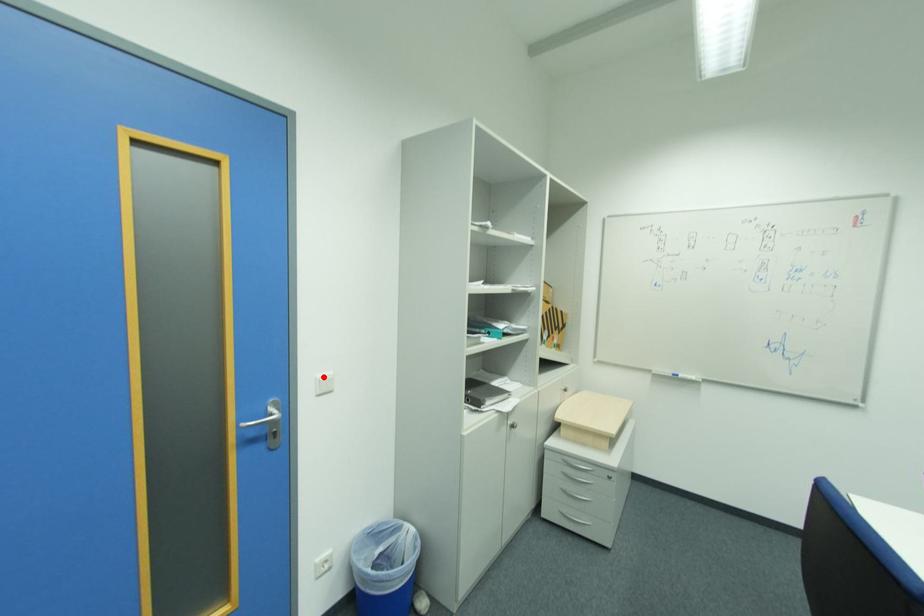
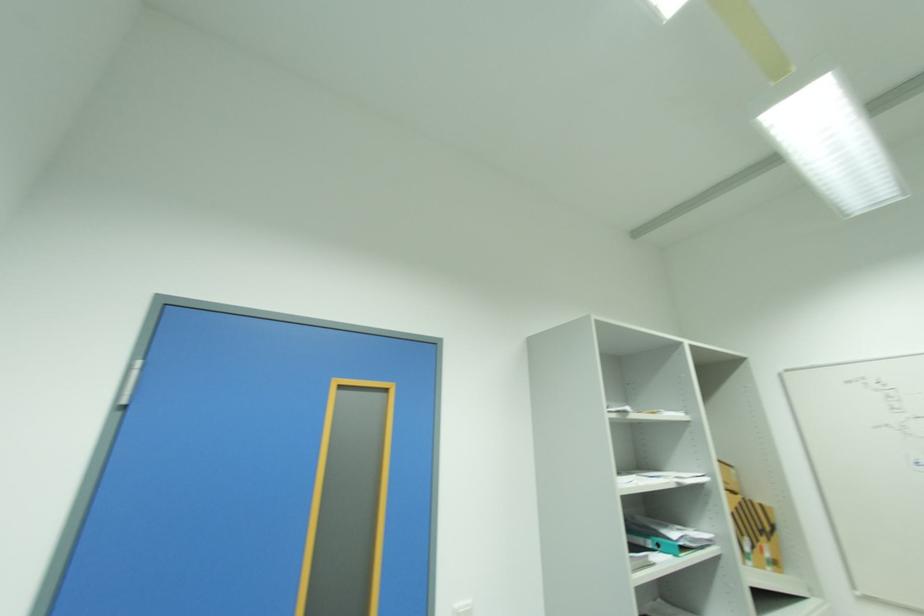
In the second image, find the point that corresponds to the highlighted location in the first image.

(463, 604)